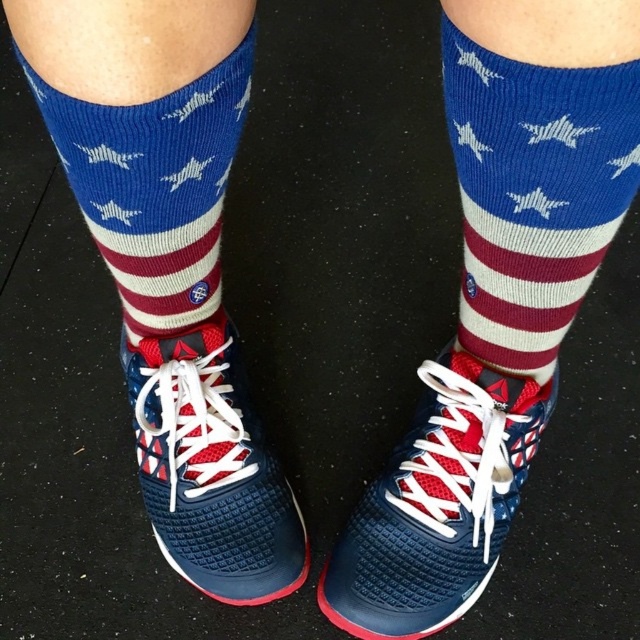
Measure the distance between navy blue mesh shoe at center and navy blue mesh shoe at lower left.

The distance of navy blue mesh shoe at center from navy blue mesh shoe at lower left is 10.03 inches.

Between navy blue mesh shoe at center and navy blue mesh shoe at lower left, which one has more height?

With more height is navy blue mesh shoe at lower left.

Which is behind, point (465, 573) or point (208, 352)?

The point (208, 352) is more distant.

This screenshot has width=640, height=640. I want to click on navy blue mesh shoe at center, so click(x=436, y=502).

Which of these two, american flag socks at center or navy blue mesh shoe at lower left, stands taller?

Standing taller between the two is navy blue mesh shoe at lower left.

Between american flag socks at center and navy blue mesh shoe at lower left, which one has less height?

Standing shorter between the two is american flag socks at center.

At what (x,y) coordinates should I click in order to perform the action: click on american flag socks at center. Please return your answer as a coordinate pair (x, y). Looking at the image, I should click on (154, 186).

Is blue knitted sock at upper center shorter than navy blue mesh shoe at lower left?

No.

Is blue knitted sock at upper center above navy blue mesh shoe at lower left?

Yes, blue knitted sock at upper center is above navy blue mesh shoe at lower left.

Between point (508, 312) and point (163, 392), which one is positioned behind?

Point (163, 392)

The width and height of the screenshot is (640, 640). What are the coordinates of `blue knitted sock at upper center` in the screenshot? It's located at (534, 192).